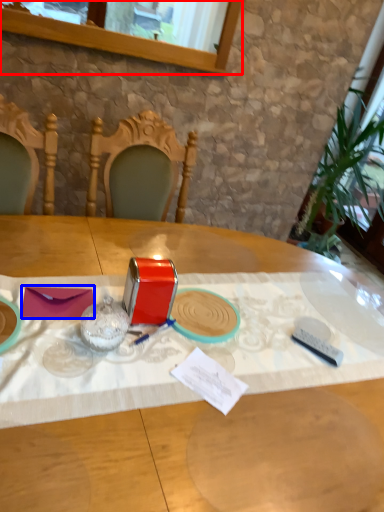
Question: Among these objects, which one is nearest to the camera, window (highlighted by a red box) or notepad (highlighted by a blue box)?

Choices:
 (A) window
 (B) notepad

Answer: (B)